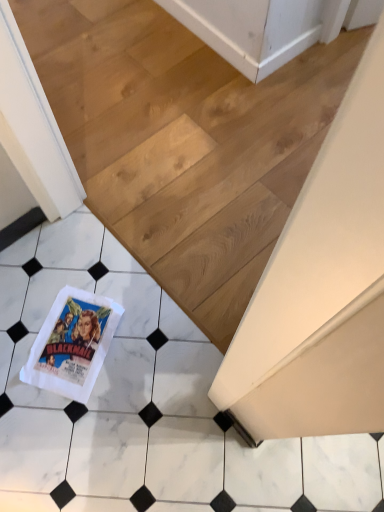
At what (x,y) coordinates should I click in order to perform the action: click on empty space that is ontop of white paper towel at lower left. Please return your answer as a coordinate pair (x, y). This screenshot has width=384, height=512. Looking at the image, I should click on (74, 339).